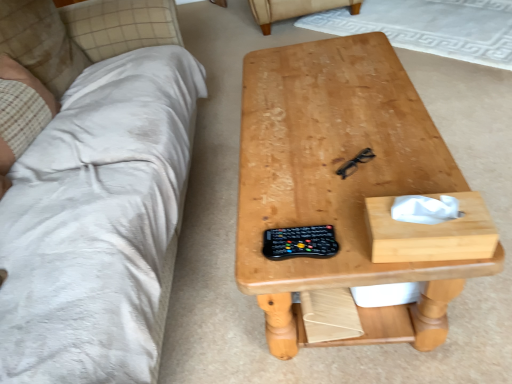
Question: From the image's perspective, is white soft pillow at upper left located above natural wood table at center?

Choices:
 (A) no
 (B) yes

Answer: (B)

Question: Is white soft pillow at upper left looking in the opposite direction of natural wood table at center?

Choices:
 (A) no
 (B) yes

Answer: (A)

Question: Does white soft pillow at upper left turn towards natural wood table at center?

Choices:
 (A) yes
 (B) no

Answer: (A)

Question: Can natural wood table at center be found inside white soft pillow at upper left?

Choices:
 (A) no
 (B) yes

Answer: (A)

Question: Is the depth of white soft pillow at upper left less than that of natural wood table at center?

Choices:
 (A) yes
 (B) no

Answer: (B)

Question: Considering the relative sizes of white soft pillow at upper left and natural wood table at center in the image provided, is white soft pillow at upper left wider than natural wood table at center?

Choices:
 (A) yes
 (B) no

Answer: (B)

Question: Are black plastic remote at center and beige fabric armchair at upper center located far from each other?

Choices:
 (A) no
 (B) yes

Answer: (B)

Question: Is black plastic remote at center at the left side of beige fabric armchair at upper center?

Choices:
 (A) no
 (B) yes

Answer: (B)

Question: From a real-world perspective, is black plastic remote at center under beige fabric armchair at upper center?

Choices:
 (A) yes
 (B) no

Answer: (B)

Question: Is beige fabric armchair at upper center surrounded by black plastic remote at center?

Choices:
 (A) yes
 (B) no

Answer: (B)

Question: Is black plastic remote at center closer to camera compared to beige fabric armchair at upper center?

Choices:
 (A) yes
 (B) no

Answer: (A)

Question: Considering the relative sizes of black plastic remote at center and beige fabric armchair at upper center in the image provided, is black plastic remote at center shorter than beige fabric armchair at upper center?

Choices:
 (A) yes
 (B) no

Answer: (A)

Question: Is natural wood table at center outside of beige plaid fabric at left?

Choices:
 (A) no
 (B) yes

Answer: (B)